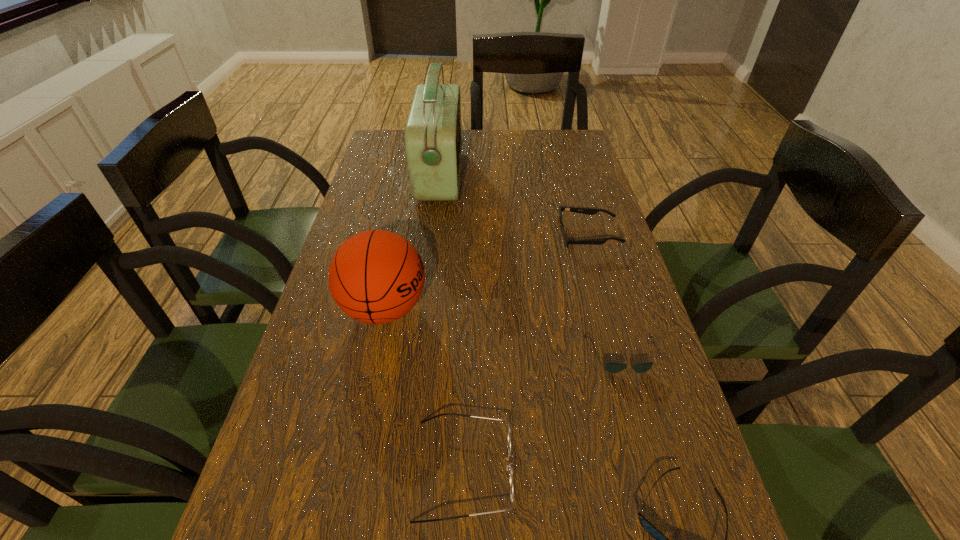
I want to click on sunglasses object that ranks as the closest to the nearest sunglasses, so click(611, 367).